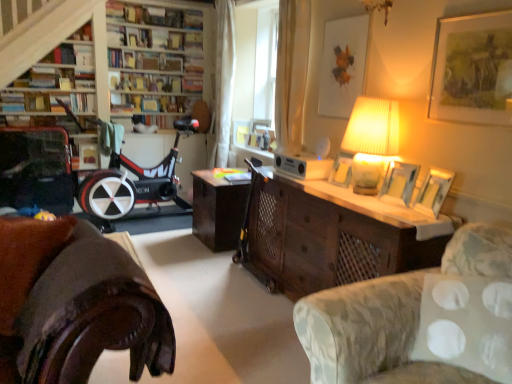
Question: Is matte yellow lampshade at upper right thinner than wooden bookshelf at upper left?

Choices:
 (A) yes
 (B) no

Answer: (A)

Question: Considering the relative sizes of matte yellow lampshade at upper right and wooden bookshelf at upper left in the image provided, is matte yellow lampshade at upper right wider than wooden bookshelf at upper left?

Choices:
 (A) yes
 (B) no

Answer: (B)

Question: Considering the relative positions of matte yellow lampshade at upper right and wooden bookshelf at upper left in the image provided, is matte yellow lampshade at upper right to the right of wooden bookshelf at upper left from the viewer's perspective?

Choices:
 (A) yes
 (B) no

Answer: (A)

Question: From the image's perspective, is matte yellow lampshade at upper right on top of wooden bookshelf at upper left?

Choices:
 (A) yes
 (B) no

Answer: (B)

Question: Is matte yellow lampshade at upper right shorter than wooden bookshelf at upper left?

Choices:
 (A) yes
 (B) no

Answer: (A)

Question: Is hardcover book at upper center, positioned as the third book in back-to-front order, bigger or smaller than hardcover book at upper left, the first book in the front-to-back sequence?

Choices:
 (A) big
 (B) small

Answer: (A)

Question: Considering their positions, is hardcover book at upper center, marked as the 3th book in a front-to-back arrangement, located in front of or behind hardcover book at upper left, the first book in the front-to-back sequence?

Choices:
 (A) front
 (B) behind

Answer: (B)

Question: Considering the positions of hardcover book at upper center, marked as the 3th book in a front-to-back arrangement, and hardcover book at upper left, which is counted as the fifth book, starting from the back, in the image, is hardcover book at upper center, marked as the 3th book in a front-to-back arrangement, wider or thinner than hardcover book at upper left, which is counted as the fifth book, starting from the back,?

Choices:
 (A) wide
 (B) thin

Answer: (B)

Question: From a real-world perspective, is hardcover book at upper center, positioned as the third book in back-to-front order, physically located above or below hardcover book at upper left, the first book in the front-to-back sequence?

Choices:
 (A) below
 (B) above

Answer: (B)

Question: In the image, is matte white picture frame at upper center, which is the 5th picture frame from front to back, on the left side or the right side of wooden bookshelf at upper left?

Choices:
 (A) right
 (B) left

Answer: (A)

Question: In terms of height, does matte white picture frame at upper center, which is the 5th picture frame from front to back, look taller or shorter compared to wooden bookshelf at upper left?

Choices:
 (A) short
 (B) tall

Answer: (A)

Question: Is matte white picture frame at upper center, the 1th picture frame viewed from the back, bigger or smaller than wooden bookshelf at upper left?

Choices:
 (A) big
 (B) small

Answer: (B)

Question: Is point (325, 43) closer or farther from the camera than point (27, 6)?

Choices:
 (A) farther
 (B) closer

Answer: (B)

Question: From a real-world perspective, is matte white picture frame at upper center, the 1th picture frame viewed from the back, above or below hardcover book at center, which is the fourth book from front to back?

Choices:
 (A) above
 (B) below

Answer: (A)

Question: Is point (330, 33) positioned closer to the camera than point (120, 104)?

Choices:
 (A) closer
 (B) farther

Answer: (A)